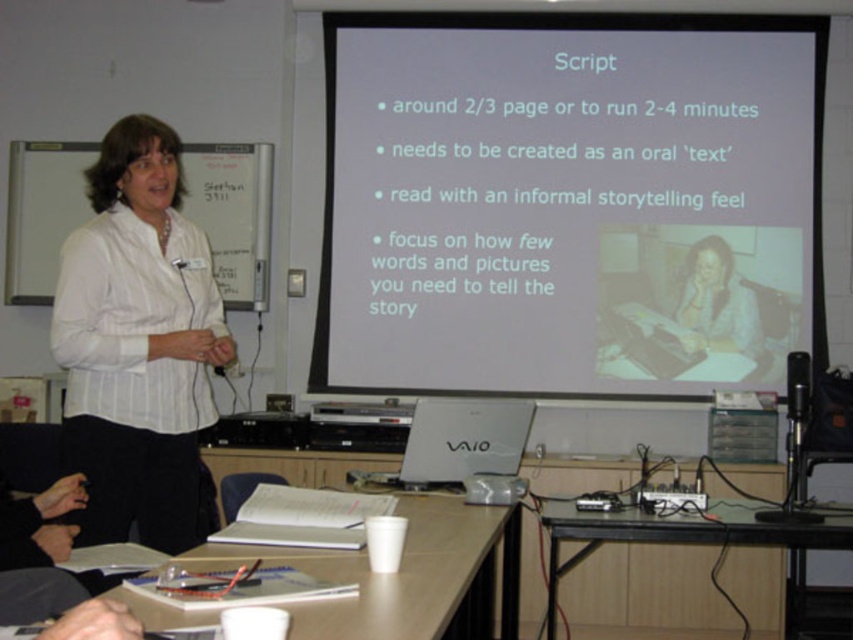
Between point (711, 340) and point (670, 486), which one is positioned behind?

The point (711, 340) is behind.

Can you confirm if light brown hair at upper right is positioned below black plastic projector at center?

Incorrect, light brown hair at upper right is not positioned below black plastic projector at center.

Is point (753, 305) less distant than point (660, 488)?

No, it is behind (660, 488).

Identify the location of light brown hair at upper right. (717, 304).

Does silver metallic laptop at center have a greater width compared to light brown hair at upper right?

Correct, the width of silver metallic laptop at center exceeds that of light brown hair at upper right.

Does silver metallic laptop at center come behind light brown hair at upper right?

That is False.

Who is more distant from viewer, (482, 416) or (711, 259)?

Point (711, 259)

Where is `silver metallic laptop at center`? Image resolution: width=853 pixels, height=640 pixels. silver metallic laptop at center is located at coordinates pos(457,442).

This screenshot has height=640, width=853. I want to click on white plastic table at lower center, so click(405, 576).

Which is above, white plastic table at lower center or silver metallic laptop at center?

Result: silver metallic laptop at center

Is point (339, 561) positioned before point (434, 426)?

Yes, it is in front of point (434, 426).

The height and width of the screenshot is (640, 853). Identify the location of white plastic table at lower center. (405, 576).